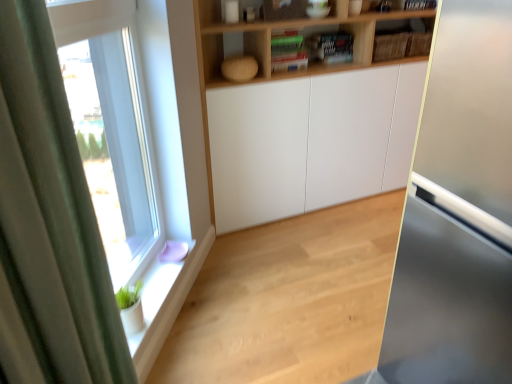
Question: Is natural wood floor at lower left directly adjacent to clear glass window at left?

Choices:
 (A) no
 (B) yes

Answer: (A)

Question: Can you confirm if natural wood floor at lower left is shorter than clear glass window at left?

Choices:
 (A) no
 (B) yes

Answer: (B)

Question: From a real-world perspective, is natural wood floor at lower left over clear glass window at left?

Choices:
 (A) no
 (B) yes

Answer: (A)

Question: Does natural wood floor at lower left have a larger size compared to clear glass window at left?

Choices:
 (A) no
 (B) yes

Answer: (B)

Question: Is natural wood floor at lower left taller than clear glass window at left?

Choices:
 (A) no
 (B) yes

Answer: (A)

Question: Is natural wood floor at lower left oriented towards clear glass window at left?

Choices:
 (A) no
 (B) yes

Answer: (A)

Question: Is white glossy window sill at lower left looking in the opposite direction of clear glass window at left?

Choices:
 (A) yes
 (B) no

Answer: (B)

Question: Does white glossy window sill at lower left have a greater height compared to clear glass window at left?

Choices:
 (A) yes
 (B) no

Answer: (B)

Question: From the image's perspective, is white glossy window sill at lower left below clear glass window at left?

Choices:
 (A) yes
 (B) no

Answer: (A)

Question: Considering the relative sizes of white glossy window sill at lower left and clear glass window at left in the image provided, is white glossy window sill at lower left smaller than clear glass window at left?

Choices:
 (A) no
 (B) yes

Answer: (B)

Question: Is white glossy window sill at lower left positioned before clear glass window at left?

Choices:
 (A) yes
 (B) no

Answer: (B)

Question: Is white glossy window sill at lower left to the right of clear glass window at left from the viewer's perspective?

Choices:
 (A) yes
 (B) no

Answer: (A)

Question: From the image's perspective, is wooden shelf at upper center under green fabric curtain at left?

Choices:
 (A) yes
 (B) no

Answer: (B)